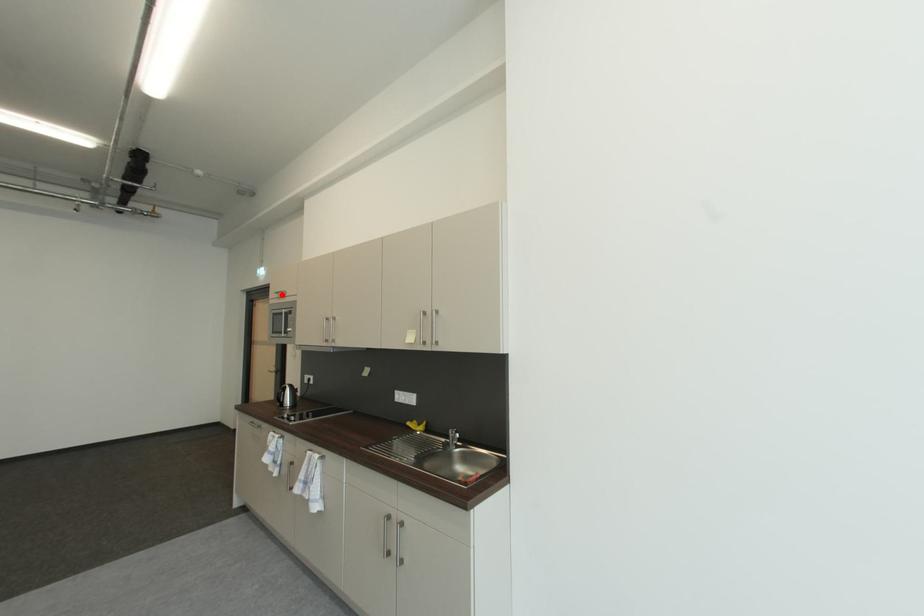
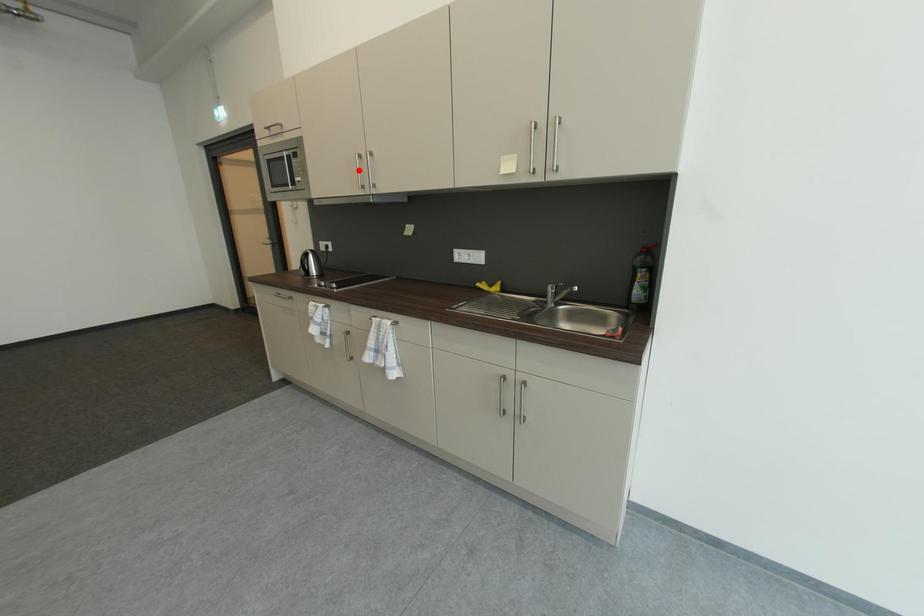
I am providing you with two images of the same scene from different viewpoints. A red point is marked on the first image and another point is marked on the second image. Are the points marked in image1 and image2 representing the same 3D position?

No